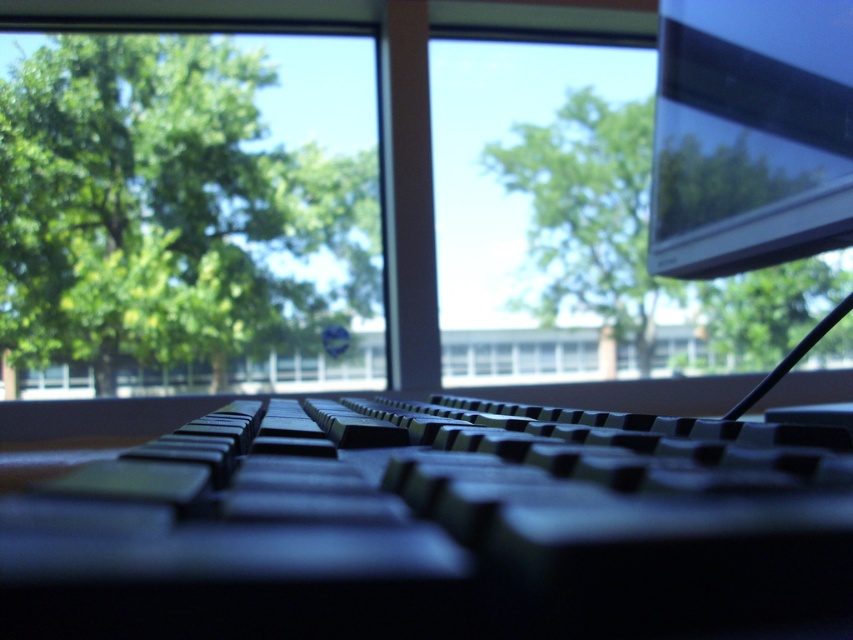
How much distance is there between green leafy tree at upper left and green leafy tree at upper center?

green leafy tree at upper left is 1.83 meters away from green leafy tree at upper center.

Does green leafy tree at upper left have a greater width compared to green leafy tree at upper center?

Indeed, green leafy tree at upper left has a greater width compared to green leafy tree at upper center.

Who is more distant from viewer, (193, 65) or (619, 250)?

Positioned behind is point (193, 65).

Where is `green leafy tree at upper left`? green leafy tree at upper left is located at coordinates (189, 212).

Is black plastic keyboard at center to the left of green leafy tree at upper center from the viewer's perspective?

Correct, you'll find black plastic keyboard at center to the left of green leafy tree at upper center.

Is black plastic keyboard at center above green leafy tree at upper center?

No, black plastic keyboard at center is not above green leafy tree at upper center.

Locate an element on the screen. black plastic keyboard at center is located at coordinates (433, 529).

Which is in front, point (85, 314) or point (726, 115)?

Point (726, 115) is in front.

Between green leafy tree at upper left and matte black monitor at upper right, which one is positioned higher?

green leafy tree at upper left is above.

Is point (305, 266) more distant than point (723, 134)?

Yes.

You are a GUI agent. You are given a task and a screenshot of the screen. Output one action in this format:
    pyautogui.click(x=<x>, y=<y>)
    Task: Click on the green leafy tree at upper left
    This screenshot has height=640, width=853.
    Given the screenshot: What is the action you would take?
    pyautogui.click(x=189, y=212)